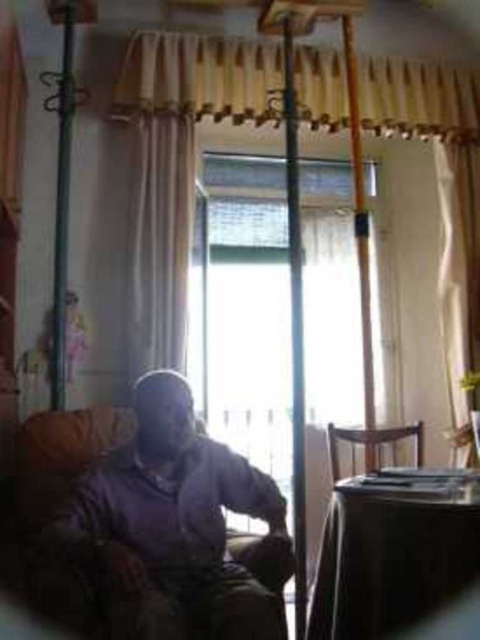
Is matte purple sweater at center thinner than beige textured curtain at center?

Indeed, matte purple sweater at center has a lesser width compared to beige textured curtain at center.

Does matte purple sweater at center appear on the left side of beige textured curtain at center?

Indeed, matte purple sweater at center is positioned on the left side of beige textured curtain at center.

The height and width of the screenshot is (640, 480). Describe the element at coordinates (180, 516) in the screenshot. I see `matte purple sweater at center` at that location.

This screenshot has height=640, width=480. I want to click on matte purple sweater at center, so click(x=180, y=516).

Is point (276, 614) positioned behind point (335, 472)?

No, it is in front of (335, 472).

Can you confirm if matte purple sweater at center is shorter than brown wooden chair at lower right?

No.

Where is `matte purple sweater at center`? The width and height of the screenshot is (480, 640). matte purple sweater at center is located at coordinates (180, 516).

Locate an element on the screen. beige textured curtain at center is located at coordinates coord(407,124).

Who is more forward, (468, 177) or (326, 428)?

Point (468, 177) is more forward.

Identify the location of beige textured curtain at center. The image size is (480, 640). (407, 124).